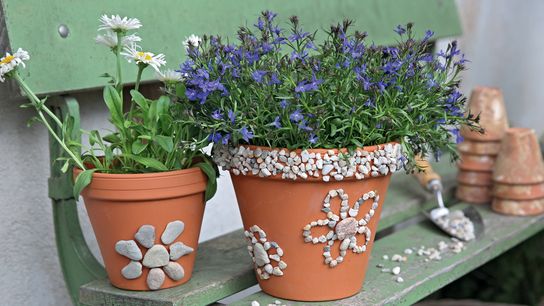
Where is `terra cotta flowerpots`? terra cotta flowerpots is located at coordinates (136, 216), (276, 205), (506, 209), (508, 191), (510, 163), (484, 120), (487, 144), (480, 160), (479, 179), (476, 196).